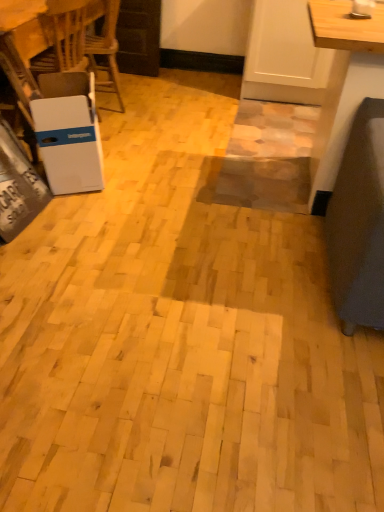
Question: Would you say white plastic table at left contains white cardboard box at left?

Choices:
 (A) no
 (B) yes

Answer: (A)

Question: Is white plastic table at left oriented away from white cardboard box at left?

Choices:
 (A) yes
 (B) no

Answer: (B)

Question: Considering the relative positions of white plastic table at left and white cardboard box at left in the image provided, is white plastic table at left in front of white cardboard box at left?

Choices:
 (A) no
 (B) yes

Answer: (A)

Question: From a real-world perspective, does white plastic table at left sit lower than white cardboard box at left?

Choices:
 (A) yes
 (B) no

Answer: (B)

Question: Does white plastic table at left have a greater height compared to white cardboard box at left?

Choices:
 (A) no
 (B) yes

Answer: (B)

Question: Are white plastic table at left and white cardboard box at left located far from each other?

Choices:
 (A) yes
 (B) no

Answer: (B)

Question: Is white cardboard box at left thinner than white plastic table at left?

Choices:
 (A) no
 (B) yes

Answer: (B)

Question: From the image's perspective, would you say white cardboard box at left is shown under white plastic table at left?

Choices:
 (A) no
 (B) yes

Answer: (B)

Question: Would you say white cardboard box at left is a long distance from white plastic table at left?

Choices:
 (A) yes
 (B) no

Answer: (B)

Question: Is the position of white cardboard box at left less distant than that of white plastic table at left?

Choices:
 (A) yes
 (B) no

Answer: (A)

Question: Is white cardboard box at left wider than white plastic table at left?

Choices:
 (A) yes
 (B) no

Answer: (B)

Question: Can you confirm if white cardboard box at left is smaller than white plastic table at left?

Choices:
 (A) no
 (B) yes

Answer: (B)

Question: Is white cardboard box at left bigger or smaller than white plastic table at left?

Choices:
 (A) big
 (B) small

Answer: (B)